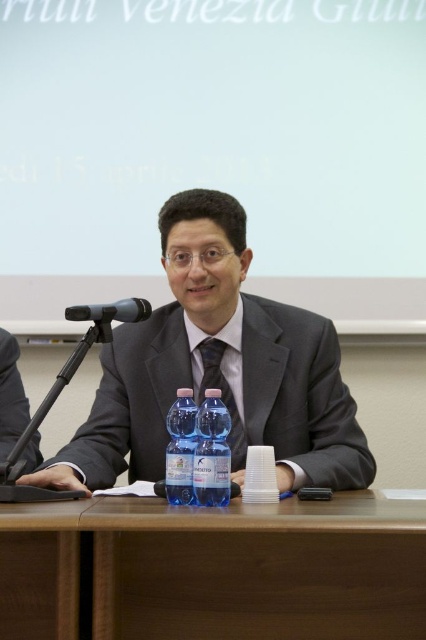
You are a stagehand setting up for a presentation. The presenter will need to reach for water easily while speaking. Given the distance between the transparent plastic bottle at center and the black silk tie at center, can the presenter comfortably reach the bottle without moving their upper body?

The distance between the transparent plastic bottle at center and the black silk tie at center is 13.17 inches. Since the tie is on the presenter, this indicates the bottle is within comfortable reach, so yes, the presenter can easily reach the bottle without moving their upper body.

You are a photographer setting up for a portrait of the man at the table. You need to place a small prop exactly halfway between the two points labeled point (192, 397) and point (241, 445). Will the prop be closer to the viewer or farther away compared to the original points?

The prop placed halfway between point (192, 397) and point (241, 445) will be closer to the viewer than point (241, 445) but farther than point (192, 397). Since the original points have one closer and one farther, the midpoint is between them.

You are a stagehand setting up for a presentation. The camera needs to be placed exactly 1 meter away from the clear plastic bottle at center. Is the current position of the camera within the required distance?

The camera is currently 1.15 meters away from the clear plastic bottle at center, which is slightly further than the required 1 meter distance. The camera needs to be moved closer to meet the requirement.